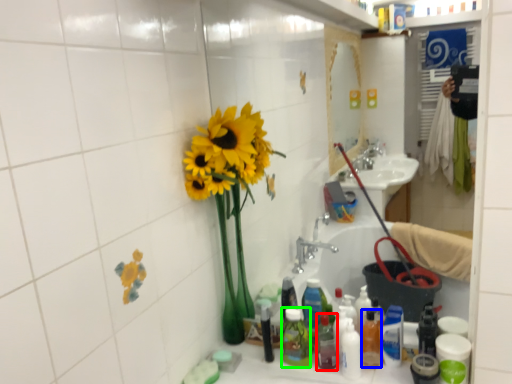
Question: Estimate the real-world distances between objects in this image. Which object is closer to bottle (highlighted by a red box), bottle (highlighted by a blue box) or toiletry (highlighted by a green box)?

Choices:
 (A) bottle
 (B) toiletry

Answer: (B)